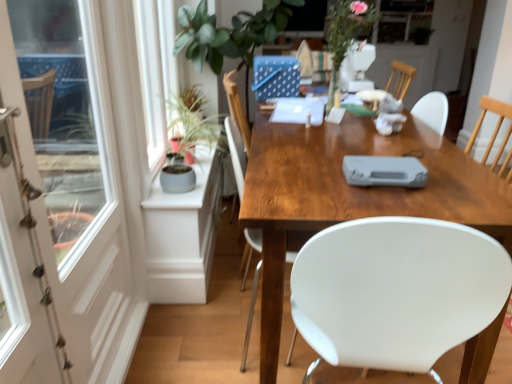
Question: Can floral arrangement at upper center be found inside white plastic game console at center?

Choices:
 (A) yes
 (B) no

Answer: (B)

Question: Is white plastic game console at center at the right side of floral arrangement at upper center?

Choices:
 (A) no
 (B) yes

Answer: (A)

Question: Are white plastic game console at center and floral arrangement at upper center making contact?

Choices:
 (A) yes
 (B) no

Answer: (B)

Question: Does white plastic game console at center appear on the left side of floral arrangement at upper center?

Choices:
 (A) yes
 (B) no

Answer: (A)

Question: Does white plastic game console at center have a lesser height compared to floral arrangement at upper center?

Choices:
 (A) yes
 (B) no

Answer: (A)

Question: From the image's perspective, is white plastic game console at center over floral arrangement at upper center?

Choices:
 (A) no
 (B) yes

Answer: (A)

Question: Is white plastic game console at center not within wooden desk at center?

Choices:
 (A) no
 (B) yes

Answer: (B)

Question: From the image's perspective, is white plastic game console at center over wooden desk at center?

Choices:
 (A) yes
 (B) no

Answer: (A)

Question: Is white plastic game console at center placed right next to wooden desk at center?

Choices:
 (A) yes
 (B) no

Answer: (B)

Question: Is white plastic game console at center oriented towards wooden desk at center?

Choices:
 (A) no
 (B) yes

Answer: (A)

Question: Considering the relative sizes of white plastic game console at center and wooden desk at center in the image provided, is white plastic game console at center wider than wooden desk at center?

Choices:
 (A) no
 (B) yes

Answer: (A)

Question: From the image's perspective, is white plastic game console at center beneath wooden desk at center?

Choices:
 (A) yes
 (B) no

Answer: (B)

Question: Is wooden desk at center smaller than metallic silver screen door at left, placed as the 2th screen door when sorted from left to right?

Choices:
 (A) no
 (B) yes

Answer: (A)